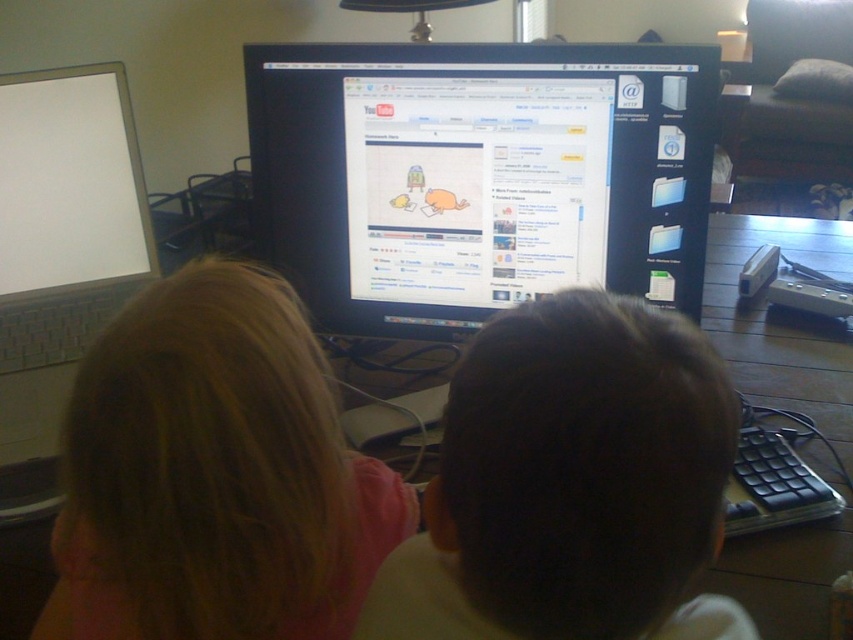
You are a student who needs to use a computer to watch a video. You see a black glossy monitor at center and a white glossy laptop at left. Which device should you interact with to start the video?

The black glossy monitor at center is to the right of the white glossy laptop at left. Since the monitor is centrally positioned and the children are focused on it, you should interact with the black glossy monitor at center to start the video.

Based on the photo, you are a photographer taking a picture of two children sitting at a desk. You need to ensure both the blonde hair at upper left and dark brown hair at center are visible in the frame. Given their heights, which child might require you to adjust your camera angle to include their hair in the photo?

The blonde hair at upper left is much taller than the dark brown hair at center, so you might need to adjust the camera angle downward to capture the taller blonde hair at upper left while still including the shorter dark brown hair at center in the frame.